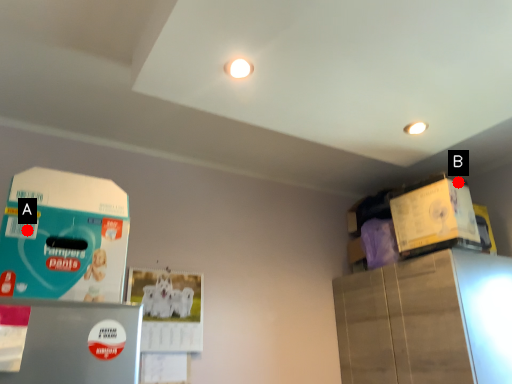
Question: Two points are circled on the image, labeled by A and B beside each circle. Which point is further to the camera?

Choices:
 (A) A is further
 (B) B is further

Answer: (B)